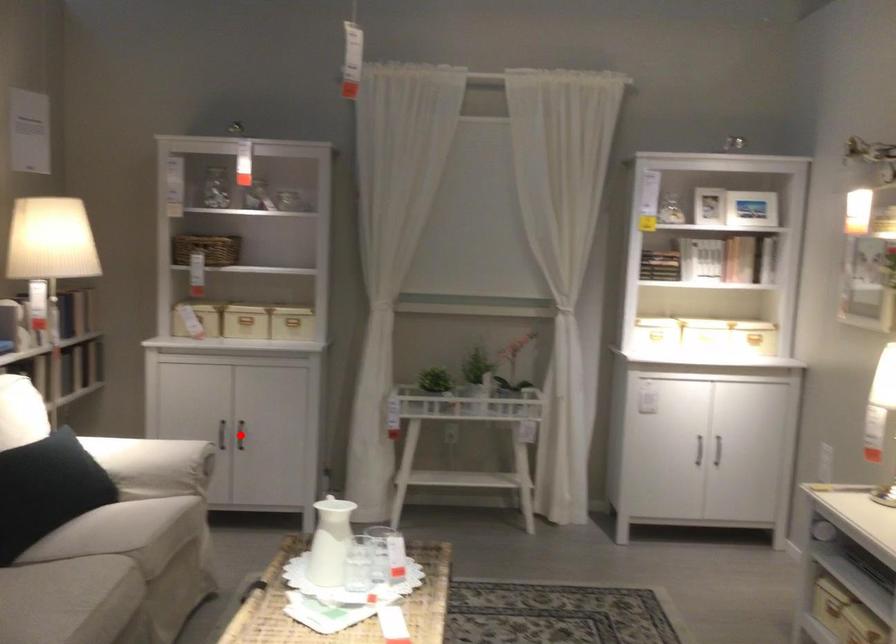
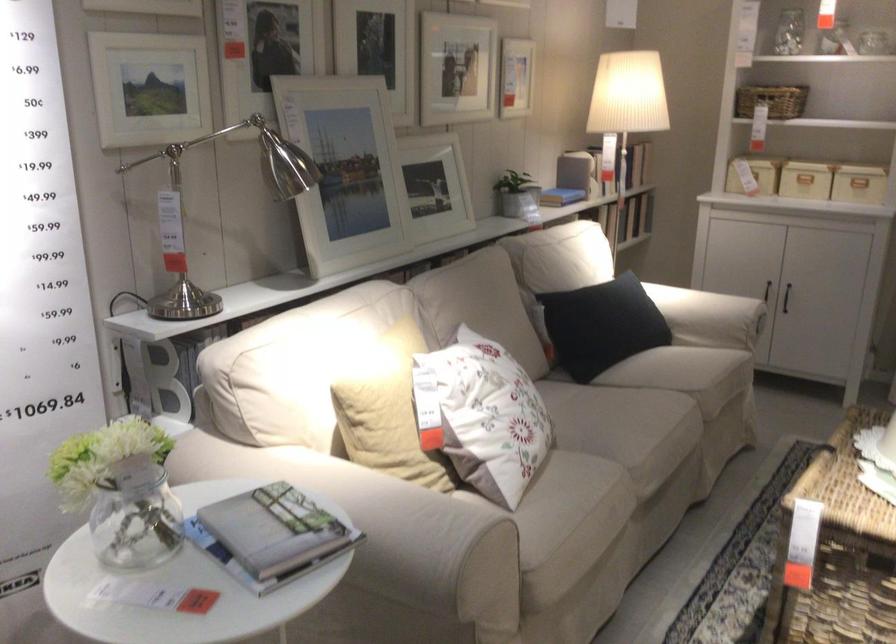
Question: I am providing you with two images of the same scene from different viewpoints. A red point is marked on the first image. Is the red point's position out of view in image 2?

Choices:
 (A) Yes
 (B) No

Answer: (A)